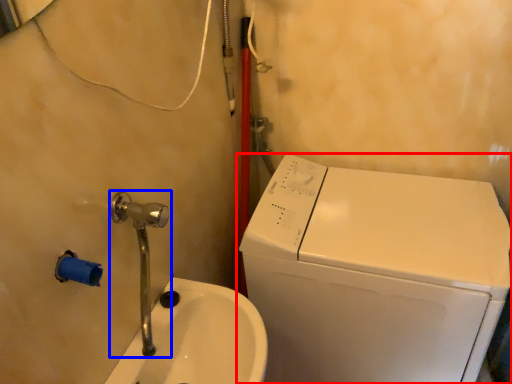
Question: Which object is further to the camera taking this photo, washing machine (highlighted by a red box) or plumbing fixture (highlighted by a blue box)?

Choices:
 (A) washing machine
 (B) plumbing fixture

Answer: (A)